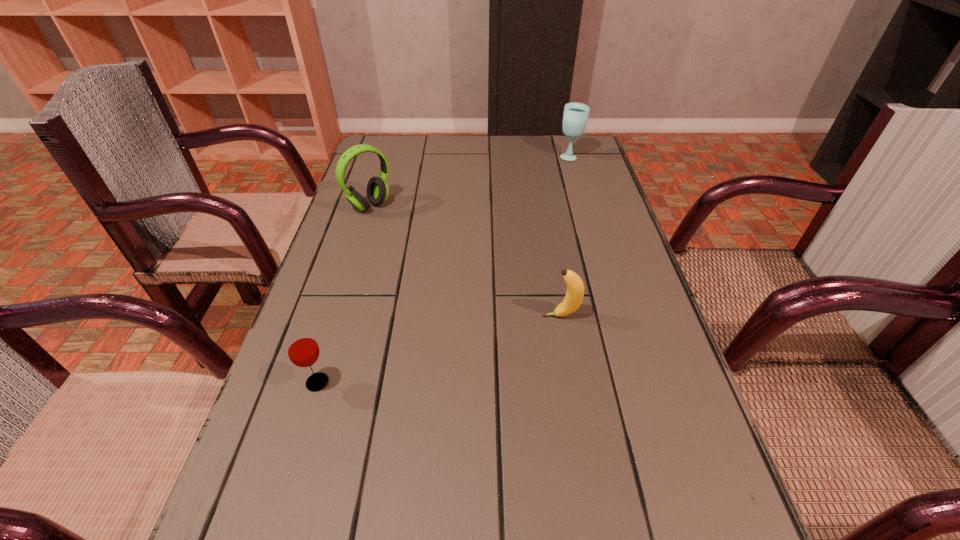
Image resolution: width=960 pixels, height=540 pixels. In order to click on headset in this screenshot , I will do tap(377, 188).

The image size is (960, 540). I want to click on the right glass, so click(x=575, y=117).

Where is `the taller glass`? the taller glass is located at coordinates coord(575,117).

You are a GUI agent. You are given a task and a screenshot of the screen. Output one action in this format:
    pyautogui.click(x=<x>, y=<y>)
    Task: Click on the second nearest object
    The image size is (960, 540).
    Given the screenshot: What is the action you would take?
    pyautogui.click(x=575, y=288)

This screenshot has height=540, width=960. Identify the location of banana. (575, 288).

Locate an element on the screen. the nearer glass is located at coordinates (302, 348).

Where is `the nearest object`? This screenshot has width=960, height=540. the nearest object is located at coordinates (302, 348).

Where is `vacant space located 0.370m on the front of the headset`? vacant space located 0.370m on the front of the headset is located at coordinates (332, 328).

This screenshot has width=960, height=540. In order to click on vacant space positioned 0.270m on the front of the farther glass in this screenshot , I will do `click(588, 214)`.

Identify the location of free space located from the stem of the third object from left to right. (480, 316).